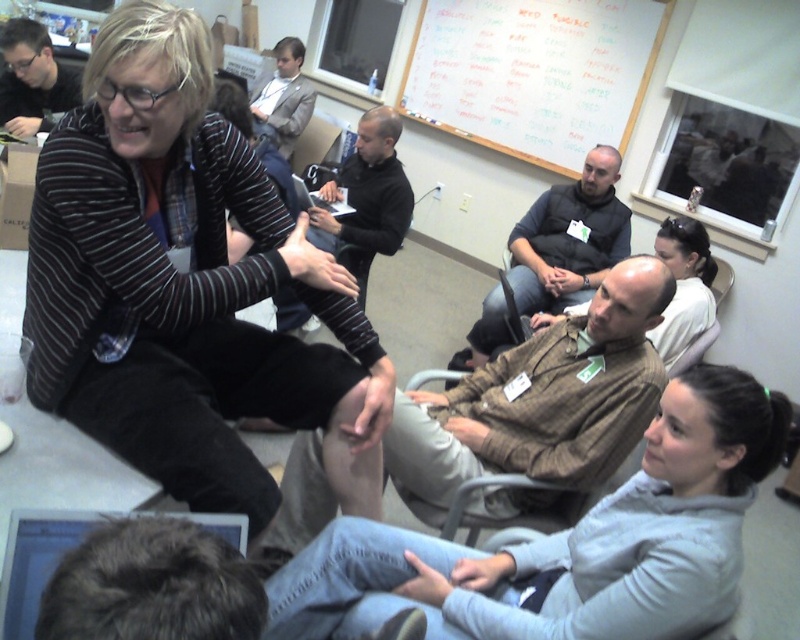
You are standing at the entrance of the room and see two points marked on the floor. The first point is at position point (x=154, y=404) and the second is at point (x=36, y=592). If you want to move from the entrance to the second point without crossing the first one, which direction should you move first?

Since point (x=154, y=404) is behind point (x=36, y=592), you should move forward towards the second point without needing to go around the first one.

You are organizing a presentation and need to choose between the silver metallic laptop at lower left and the matte black laptop at upper left. Which laptop should you pick if you want the one that is smaller in size?

The silver metallic laptop at lower left is smaller in size compared to the matte black laptop at upper left, so you should choose the silver metallic laptop at lower left.

You are standing in the room and want to take a photo of the point at coordinates (x=120, y=184). The camera you have can only focus on objects within 4 feet. Will the point be in focus?

The point at coordinates (x=120, y=184) is 4.32 feet away from the camera, which is beyond the camera focus range of 4 feet. Therefore, the point will not be in focus.